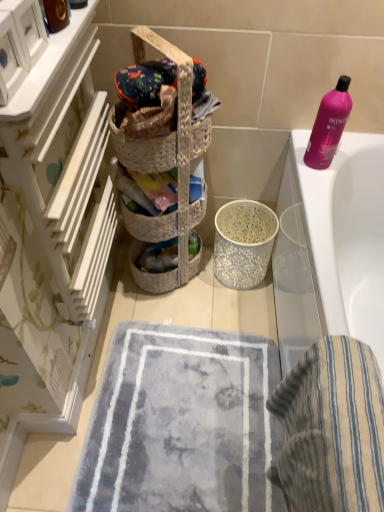
You are a GUI agent. You are given a task and a screenshot of the screen. Output one action in this format:
    pyautogui.click(x=<x>, y=<y>)
    Task: Click on the woven straw basket at center
    Image resolution: width=384 pixels, height=512 pixels.
    Given the screenshot: What is the action you would take?
    [x=177, y=118]

What do you see at coordinates (329, 125) in the screenshot?
I see `pink plastic bottle at upper right` at bounding box center [329, 125].

You are a GUI agent. You are given a task and a screenshot of the screen. Output one action in this format:
    pyautogui.click(x=<x>, y=<y>)
    Task: Click on the blue striped towel at lower right
    
    Given the screenshot: What is the action you would take?
    pyautogui.click(x=332, y=428)

From a real-world perspective, is woven straw basket at center located higher than soft gray carpet at center?

Yes, from a real-world perspective, woven straw basket at center is on top of soft gray carpet at center.

Does woven straw basket at center appear on the left side of soft gray carpet at center?

Indeed, woven straw basket at center is positioned on the left side of soft gray carpet at center.

Is woven straw basket at center wider than soft gray carpet at center?

No.

Based on the photo, is white wood drawers at left closer to the viewer compared to blue striped towel at lower right?

That is True.

Consider the image. Is white wood drawers at left next to blue striped towel at lower right and touching it?

There is a gap between white wood drawers at left and blue striped towel at lower right.

Which point is more distant from viewer, (43, 53) or (378, 441)?

The point (43, 53) is behind.

Which of these two, white wood drawers at left or blue striped towel at lower right, is wider?

Wider between the two is blue striped towel at lower right.

How different are the orientations of white wood drawers at left and woven straw basket at center in degrees?

The angular difference between white wood drawers at left and woven straw basket at center is 44 degrees.

Considering the relative sizes of white wood drawers at left and woven straw basket at center in the image provided, is white wood drawers at left smaller than woven straw basket at center?

No.

Can you confirm if white wood drawers at left is taller than woven straw basket at center?

Indeed, white wood drawers at left has a greater height compared to woven straw basket at center.

Is white wood drawers at left closer to camera compared to woven straw basket at center?

Yes, white wood drawers at left is closer to the viewer.

Who is shorter, pink plastic bottle at upper right or woven straw basket at center?

woven straw basket at center.

From the picture: How much distance is there between pink plastic bottle at upper right and woven straw basket at center?

pink plastic bottle at upper right is 15.59 inches from woven straw basket at center.

Is pink plastic bottle at upper right turned away from woven straw basket at center?

No, pink plastic bottle at upper right's orientation is not away from woven straw basket at center.

Based on the photo, from a real-world perspective, which is physically above, pink plastic bottle at upper right or woven straw basket at center?

woven straw basket at center, from a real-world perspective.

Image resolution: width=384 pixels, height=512 pixels. In order to click on bath mat below the white wood drawers at left (from the image's perspective) in this screenshot , I will do `click(182, 424)`.

Can you tell me how much white wood drawers at left and soft gray carpet at center differ in facing direction?

white wood drawers at left and soft gray carpet at center are facing 90.5 degrees away from each other.

From the image's perspective, which one is positioned lower, white wood drawers at left or soft gray carpet at center?

soft gray carpet at center is shown below in the image.

Which object is closer to the camera taking this photo, white wood drawers at left or soft gray carpet at center?

Positioned in front is white wood drawers at left.

From the image's perspective, relative to soft gray carpet at center, is blue striped towel at lower right above or below?

From the image's perspective, blue striped towel at lower right appears above soft gray carpet at center.

Can you see blue striped towel at lower right touching soft gray carpet at center?

blue striped towel at lower right is not next to soft gray carpet at center, and they're not touching.

Considering their positions, is blue striped towel at lower right located in front of or behind soft gray carpet at center?

In the image, blue striped towel at lower right appears in front of soft gray carpet at center.

Does blue striped towel at lower right have a lesser width compared to soft gray carpet at center?

Indeed, blue striped towel at lower right has a lesser width compared to soft gray carpet at center.

Is white wood drawers at left bigger or smaller than white glossy bathtub at upper right?

Considering their sizes, white wood drawers at left takes up less space than white glossy bathtub at upper right.

In the scene shown: Could you tell me if white wood drawers at left is facing white glossy bathtub at upper right?

Yes, white wood drawers at left is facing white glossy bathtub at upper right.

Are white wood drawers at left and white glossy bathtub at upper right making contact?

There is a gap between white wood drawers at left and white glossy bathtub at upper right.

From a real-world perspective, is white wood drawers at left positioned over white glossy bathtub at upper right based on gravity?

Indeed, from a real-world perspective, white wood drawers at left stands above white glossy bathtub at upper right.

The width and height of the screenshot is (384, 512). I want to click on bath mat behind the woven straw basket at center, so click(x=182, y=424).

The height and width of the screenshot is (512, 384). Identify the location of beach towel to the right of white wood drawers at left. (332, 428).

Looking at the image, which one is located further to white wood drawers at left, white glossy bathtub at upper right or woven straw basket at center?

white glossy bathtub at upper right is further to white wood drawers at left.

Considering their positions, is blue striped towel at lower right positioned further to soft gray carpet at center than white glossy bathtub at upper right?

blue striped towel at lower right is further to soft gray carpet at center.

Consider the image. When comparing their distances from woven straw basket at center, does white wood drawers at left or white glossy bathtub at upper right seem closer?

Based on the image, white wood drawers at left appears to be nearer to woven straw basket at center.

Which object lies further to the anchor point woven straw basket at center, blue striped towel at lower right or white glossy bathtub at upper right?

Among the two, blue striped towel at lower right is located further to woven straw basket at center.

When comparing their distances from white wood drawers at left, does soft gray carpet at center or white glossy bathtub at upper right seem closer?

Among the two, soft gray carpet at center is located nearer to white wood drawers at left.

Considering their positions, is soft gray carpet at center positioned further to white glossy bathtub at upper right than white wood drawers at left?

white wood drawers at left is positioned further to the anchor white glossy bathtub at upper right.

When comparing their distances from white wood drawers at left, does woven straw basket at center or pink plastic bottle at upper right seem closer?

Among the two, woven straw basket at center is located nearer to white wood drawers at left.

Estimate the real-world distances between objects in this image. Which object is closer to soft gray carpet at center, white glossy bathtub at upper right or woven straw basket at center?

The object closer to soft gray carpet at center is white glossy bathtub at upper right.

Identify the location of bathtub that lies between pink plastic bottle at upper right and soft gray carpet at center from top to bottom. This screenshot has width=384, height=512. (331, 248).

Find the location of a particular element. beach towel between white wood drawers at left and soft gray carpet at center from top to bottom is located at coordinates (332, 428).

Find the location of a particular element. The image size is (384, 512). picnic basket between pink plastic bottle at upper right and blue striped towel at lower right in the up-down direction is located at coordinates (177, 118).

Locate an element on the screen. cleaning product between white wood drawers at left and white glossy bathtub at upper right from left to right is located at coordinates (329, 125).